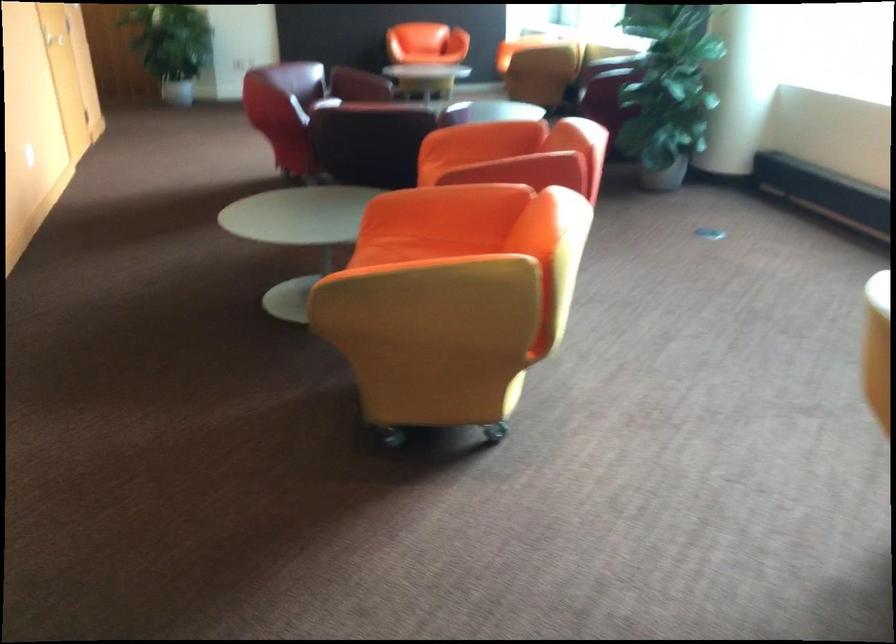
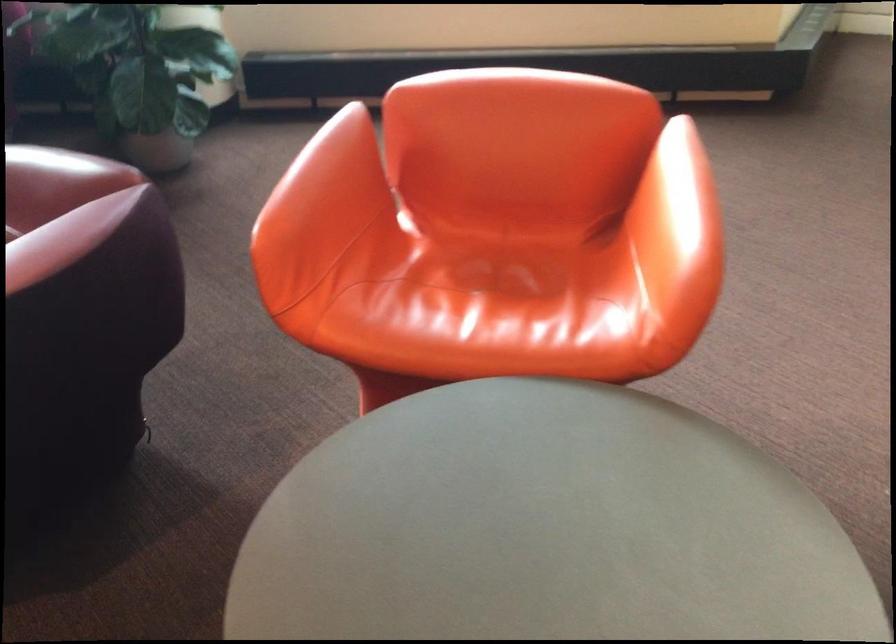
Find the pixel in the second image that matches (x=476, y=124) in the first image.

(321, 192)